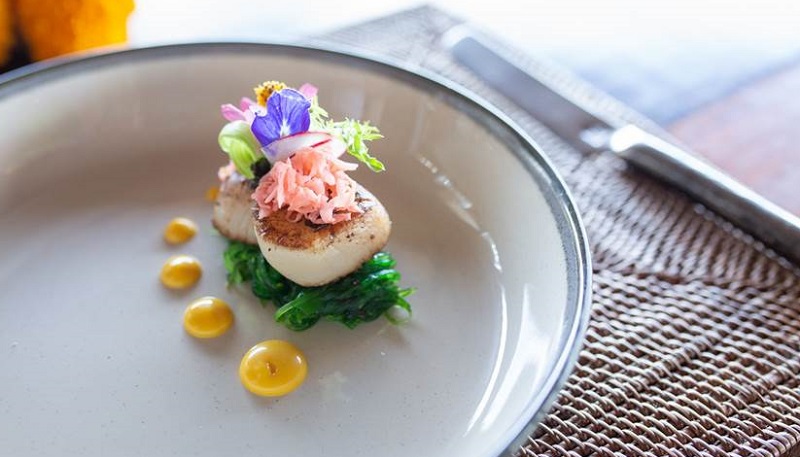
Where is `bowl`? bowl is located at coordinates (114, 378).